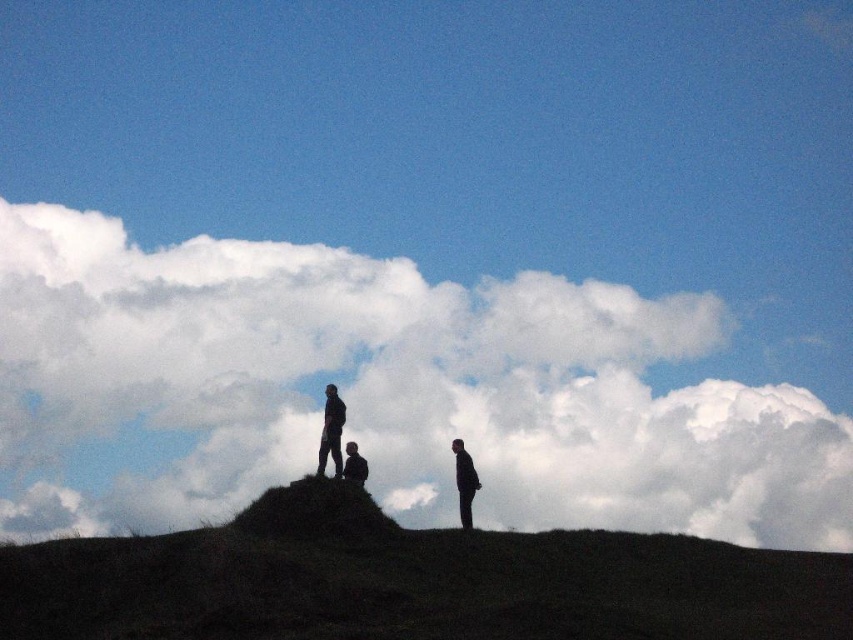
Question: Which of the following is the closest to the observer?

Choices:
 (A) dark gray suit at center
 (B) dark gray fabric jacket at center

Answer: (A)

Question: Observing the image, what is the correct spatial positioning of white fluffy cloud at upper center in reference to dark grassy hillside at center?

Choices:
 (A) left
 (B) right

Answer: (A)

Question: Based on their relative distances, which object is farther from the dark grassy hillside at center?

Choices:
 (A) dark brown earth at center
 (B) white fluffy cloud at upper center
 (C) matte black figure at center
 (D) dark gray fabric jacket at center

Answer: (B)

Question: Based on their relative distances, which object is farther from the dark brown earth at center?

Choices:
 (A) dark gray suit at center
 (B) dark gray fabric jacket at center
 (C) dark grassy hillside at center
 (D) matte black figure at center

Answer: (A)

Question: Is dark brown earth at center to the left of matte black figure at center from the viewer's perspective?

Choices:
 (A) no
 (B) yes

Answer: (A)

Question: Is white fluffy cloud at upper center wider than dark grassy hillside at center?

Choices:
 (A) no
 (B) yes

Answer: (B)